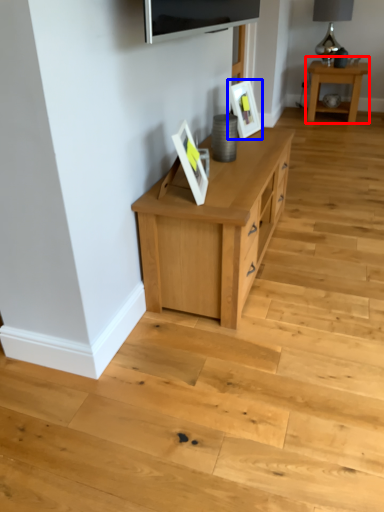
Question: Among these objects, which one is nearest to the camera, table (highlighted by a red box) or picture frame (highlighted by a blue box)?

Choices:
 (A) table
 (B) picture frame

Answer: (B)